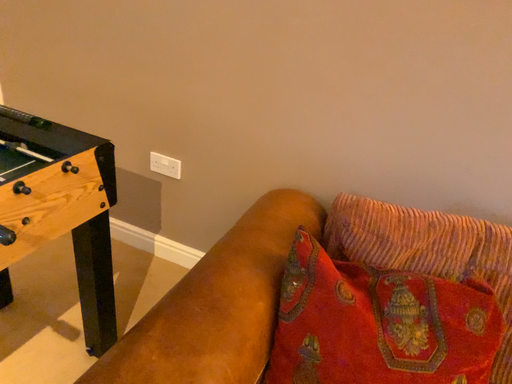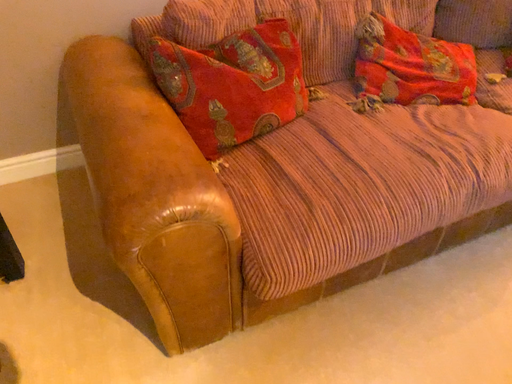
Question: Which way did the camera rotate in the video?

Choices:
 (A) rotated left
 (B) rotated right

Answer: (B)